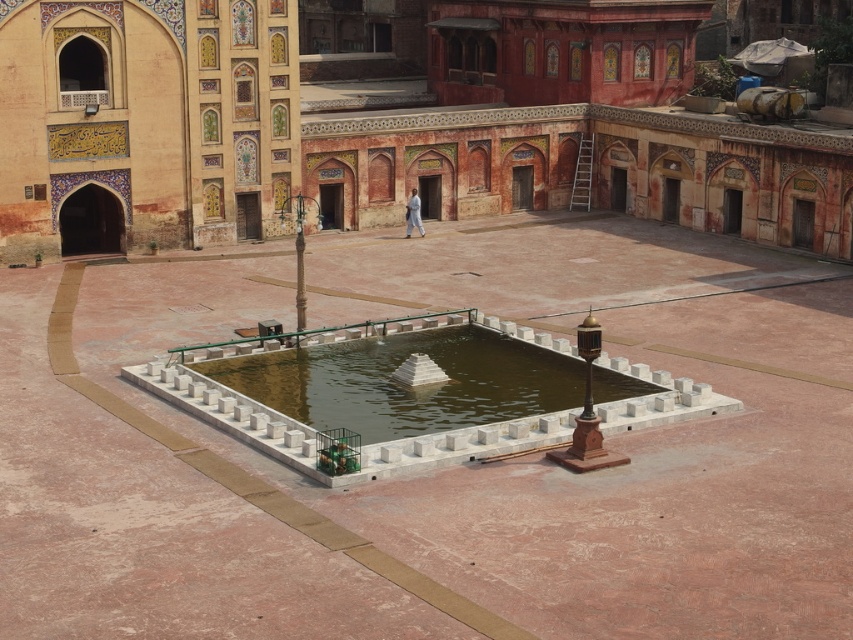
You are standing in the courtyard and want to pour water from a bucket into the clear water at center. However, you need to avoid splashing the smooth stone fountain at center. Given that the bucket can throw water up to 75 feet, can you safely pour the water without hitting the fountain?

The smooth stone fountain at center is 75.10 feet away from the clear water at center. Since the bucket can only throw water up to 75 feet, the distance is slightly beyond the bucket capacity. Therefore, pouring the water might not reach the clear water at center without hitting the fountain.

You are standing in the courtyard and want to approach the white marble fountain at center. Since the courtyard is paved with tiles, can you walk directly to the fountain without stepping into the clear water at center?

The white marble fountain at center is positioned over clear water at center, so you can walk directly to the fountain without stepping into the water because the fountain itself is above the water.